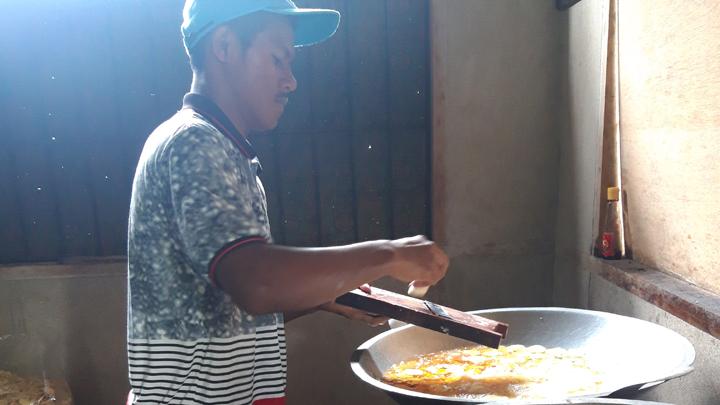
Find the location of `window blinds`. window blinds is located at coordinates (409, 54), (374, 165), (328, 186), (299, 162), (134, 71), (73, 197), (99, 112).